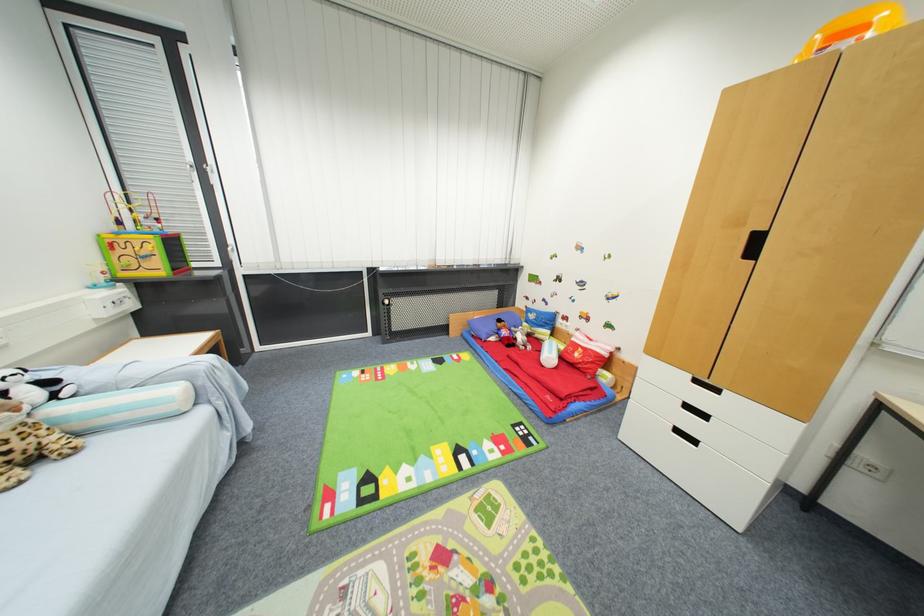
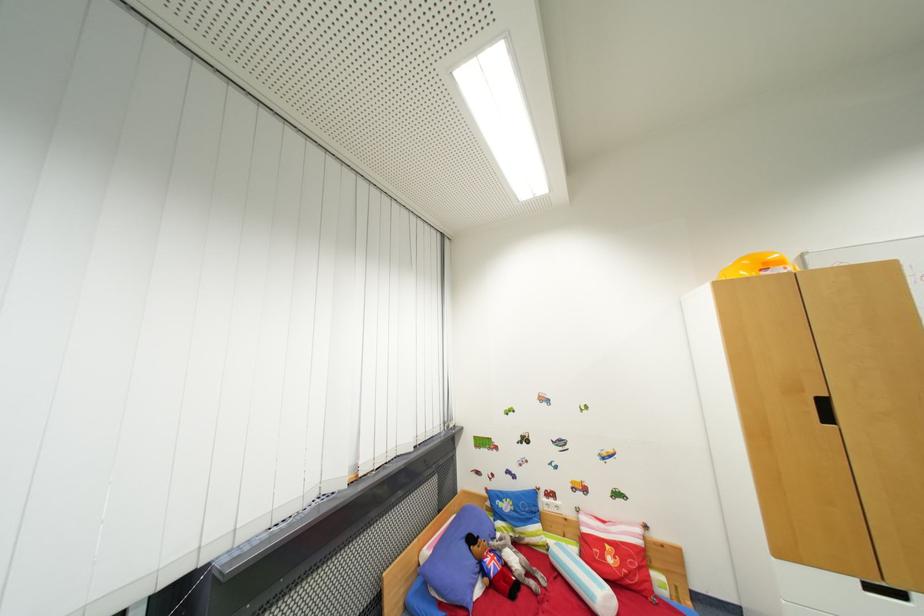
Where in the second image is the point corresponding to the point at 565,325 from the first image?

(550, 506)